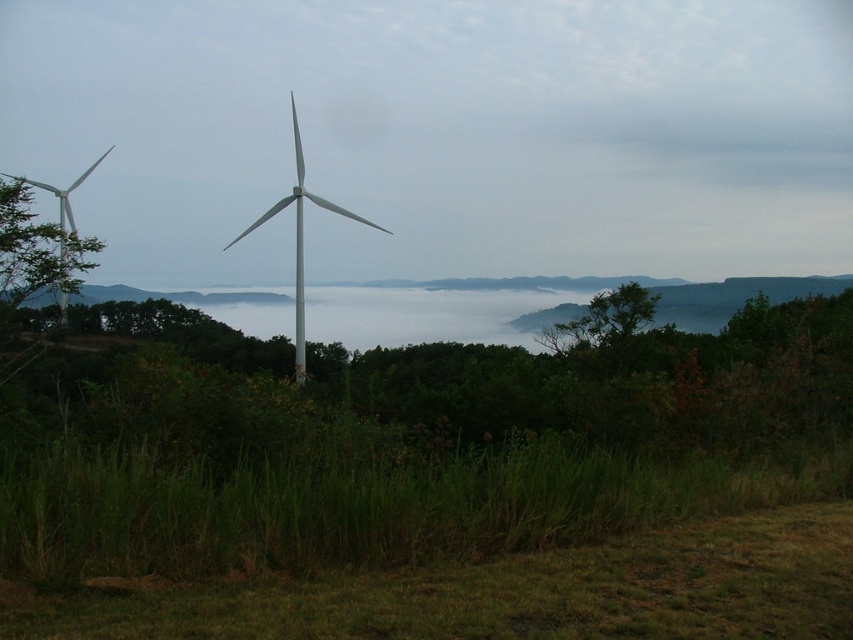
You are a drone operator flying a drone that needs to pass between the white matte wind turbine at center and the white matte windmill at left. Based on the scene, which direction should you fly to avoid hitting either structure?

The white matte windmill at left is behind the white matte wind turbine at center, so you should fly either above or below the white matte wind turbine at center to avoid collision with both structures.

You are a landscape photographer planning to capture the entire scene in one shot. Given that the white matte wind turbine at center and the white matte windmill at left are both in your frame, which one would you need to adjust your camera angle to include more of due to its size?

The white matte windmill at left requires adjusting the camera angle more because it occupies more space than the white matte wind turbine at center.

You are standing in the middle of the field looking at the landscape. You see the white matte wind turbine at center and the white matte windmill at left. Which one is positioned to the right of the other?

The white matte wind turbine at center is positioned to the right of the white matte windmill at left.